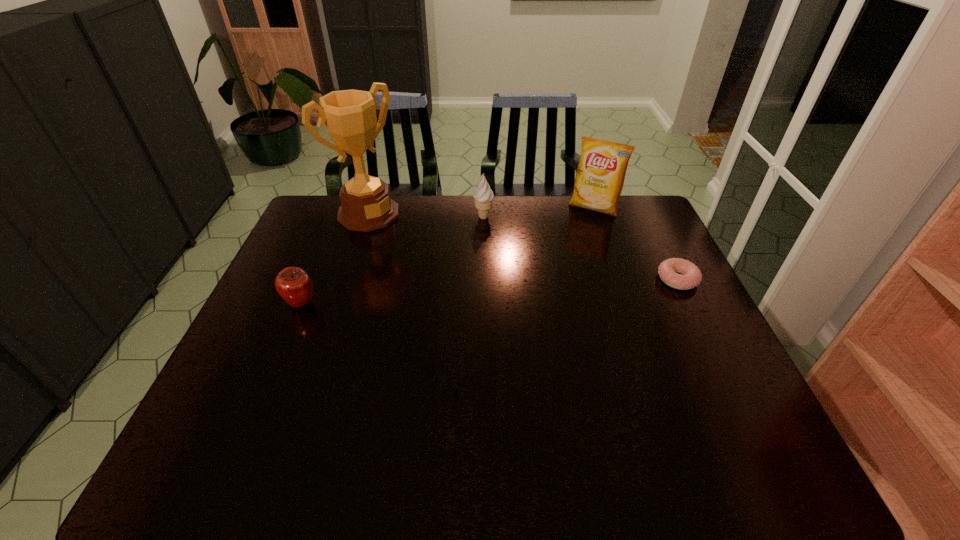
At what (x,y) coordinates should I click in order to perform the action: click on vacant area located on the front-facing side of the third tallest object. Please return your answer as a coordinate pair (x, y). The width and height of the screenshot is (960, 540). Looking at the image, I should click on (460, 265).

You are a GUI agent. You are given a task and a screenshot of the screen. Output one action in this format:
    pyautogui.click(x=<x>, y=<y>)
    Task: Click on the vacant region located 0.270m on the front-facing side of the third tallest object
    The image size is (960, 540).
    Given the screenshot: What is the action you would take?
    coord(456,273)

Locate an element on the screen. free space located 0.100m on the front-facing side of the third tallest object is located at coordinates (472, 240).

The width and height of the screenshot is (960, 540). In order to click on vacant space located on the front-facing side of the award in this screenshot , I will do `click(455, 278)`.

Locate an element on the screen. The height and width of the screenshot is (540, 960). free spot located 0.190m on the front-facing side of the award is located at coordinates (421, 253).

You are a GUI agent. You are given a task and a screenshot of the screen. Output one action in this format:
    pyautogui.click(x=<x>, y=<y>)
    Task: Click on the vacant space located on the front-facing side of the award
    This screenshot has height=540, width=960.
    Given the screenshot: What is the action you would take?
    pyautogui.click(x=410, y=244)

You are a GUI agent. You are given a task and a screenshot of the screen. Output one action in this format:
    pyautogui.click(x=<x>, y=<y>)
    Task: Click on the vacant space situated 0.110m on the front-facing side of the fourth shortest object
    
    Given the screenshot: What is the action you would take?
    pyautogui.click(x=577, y=234)

Find the location of `free space located on the front-facing side of the fourth shortest object`. free space located on the front-facing side of the fourth shortest object is located at coordinates (548, 285).

In order to click on vacant point located 0.100m on the front-facing side of the fourth shortest object in this screenshot , I will do `click(578, 233)`.

The width and height of the screenshot is (960, 540). Identify the location of icecream present at the far edge. (483, 196).